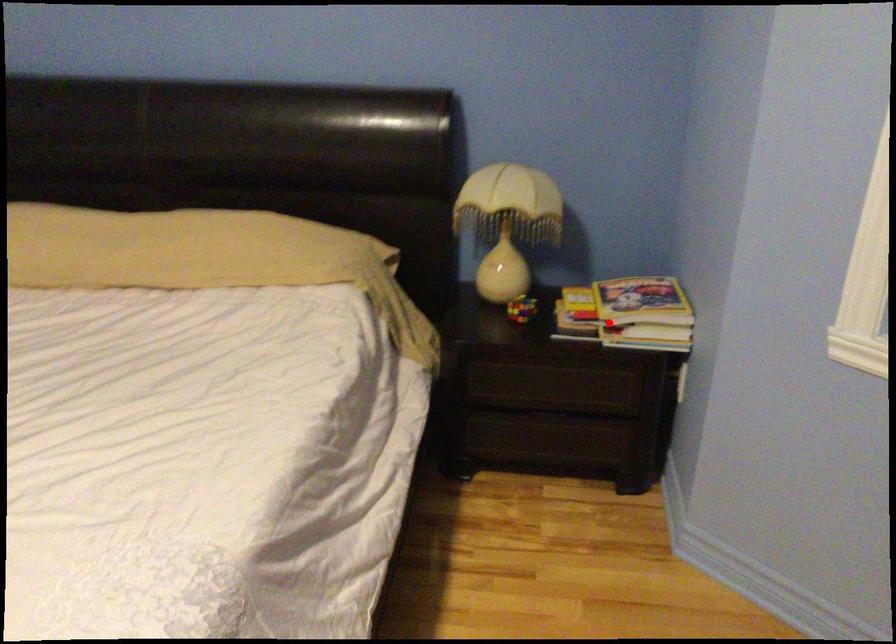
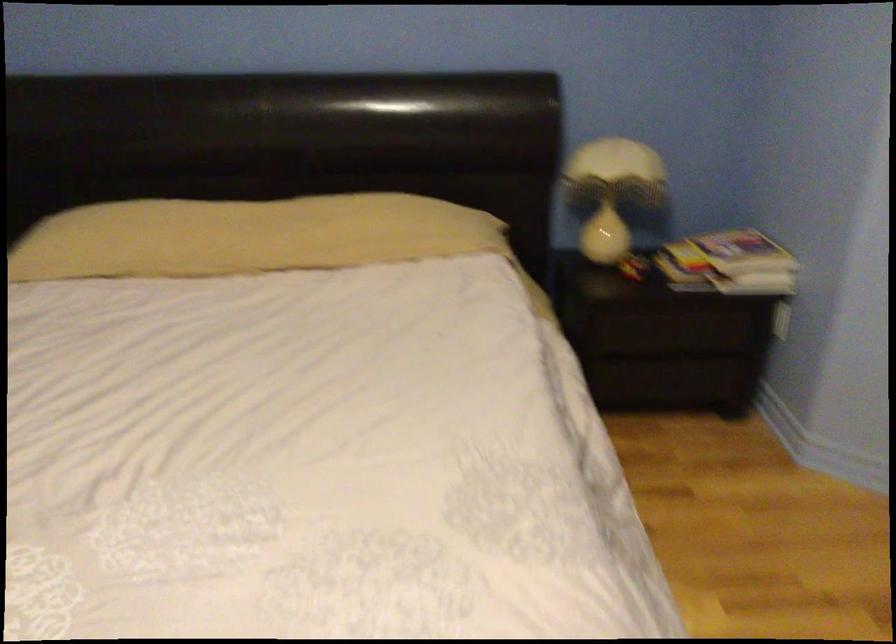
Question: I am providing you with two images of the same scene from different viewpoints. Given a red point in image1, look at the same physical point in image2. Is it:

Choices:
 (A) Closer to the viewpoint
 (B) Farther from the viewpoint

Answer: (B)